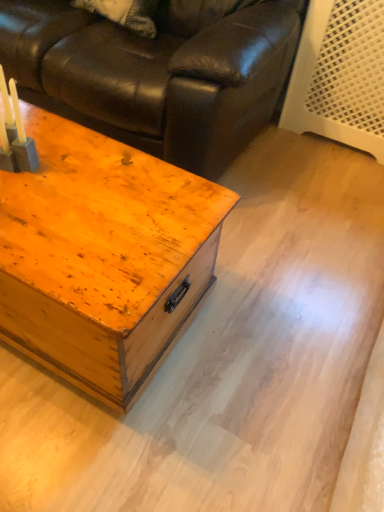
Question: From a real-world perspective, is matte black leather couch at upper left located higher than matte gray candle holder at left?

Choices:
 (A) no
 (B) yes

Answer: (A)

Question: Is matte black leather couch at upper left taller than matte gray candle holder at left?

Choices:
 (A) no
 (B) yes

Answer: (B)

Question: Are matte black leather couch at upper left and matte gray candle holder at left located far from each other?

Choices:
 (A) no
 (B) yes

Answer: (A)

Question: Is matte black leather couch at upper left outside matte gray candle holder at left?

Choices:
 (A) no
 (B) yes

Answer: (B)

Question: Is matte black leather couch at upper left thinner than matte gray candle holder at left?

Choices:
 (A) no
 (B) yes

Answer: (A)

Question: Is wooden trunk at center to the left or to the right of matte black leather couch at upper left in the image?

Choices:
 (A) right
 (B) left

Answer: (B)

Question: From the image's perspective, is wooden trunk at center positioned above or below matte black leather couch at upper left?

Choices:
 (A) above
 (B) below

Answer: (B)

Question: From their relative heights in the image, would you say wooden trunk at center is taller or shorter than matte black leather couch at upper left?

Choices:
 (A) tall
 (B) short

Answer: (B)

Question: Considering the positions of wooden trunk at center and matte black leather couch at upper left in the image, is wooden trunk at center wider or thinner than matte black leather couch at upper left?

Choices:
 (A) thin
 (B) wide

Answer: (A)

Question: From a real-world perspective, relative to matte gray candle holder at left, is wooden trunk at center vertically above or below?

Choices:
 (A) below
 (B) above

Answer: (A)

Question: Considering the positions of wooden trunk at center and matte gray candle holder at left in the image, is wooden trunk at center taller or shorter than matte gray candle holder at left?

Choices:
 (A) short
 (B) tall

Answer: (B)

Question: Do you think wooden trunk at center is within matte gray candle holder at left, or outside of it?

Choices:
 (A) inside
 (B) outside

Answer: (B)

Question: From the image's perspective, is wooden trunk at center positioned above or below matte gray candle holder at left?

Choices:
 (A) above
 (B) below

Answer: (B)

Question: From their relative heights in the image, would you say matte black leather couch at upper left is taller or shorter than wooden trunk at center?

Choices:
 (A) short
 (B) tall

Answer: (B)

Question: From the image's perspective, is matte black leather couch at upper left located above or below wooden trunk at center?

Choices:
 (A) below
 (B) above

Answer: (B)